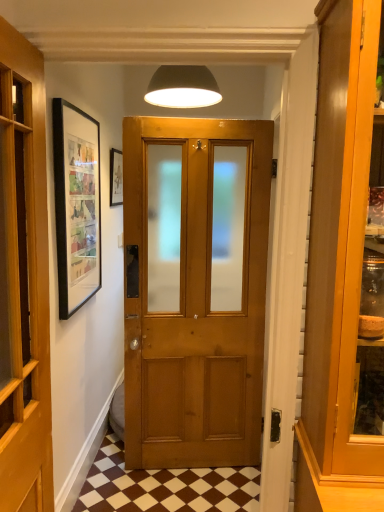
Find the location of a particular element. Image resolution: width=384 pixels, height=512 pixels. wooden door at center is located at coordinates (24, 281).

What do you see at coordinates (183, 87) in the screenshot? I see `matte black lampshade at upper center` at bounding box center [183, 87].

Locate an element on the screen. The image size is (384, 512). brown checkered tile at lower center is located at coordinates (164, 486).

Locate an element on the screen. This screenshot has width=384, height=512. wooden door at center is located at coordinates pos(24,281).

Locate an element on the screen. This screenshot has height=512, width=384. picture frame behind the matte black lampshade at upper center is located at coordinates (116, 177).

Measure the distance between matte black picture frame at upper left and matte black lampshade at upper center.

25.88 inches.

Is point (120, 183) closer or farther from the camera than point (147, 92)?

Point (120, 183) appears to be closer to the viewer than point (147, 92).

Between matte black lampshade at upper center and wooden door at center, which one has larger size?

With larger size is wooden door at center.

Considering the points (166, 75) and (40, 85), which point is in front, point (166, 75) or point (40, 85)?

Positioned in front is point (40, 85).

Is matte black lampshade at upper center shorter than wooden door at center?

Correct, matte black lampshade at upper center is not as tall as wooden door at center.

Which is more to the left, matte black lampshade at upper center or wooden door at center?

From the viewer's perspective, wooden door at center appears more on the left side.

From the picture: What's the angular difference between brown checkered tile at lower center and wooden door at center's facing directions?

The angular difference between brown checkered tile at lower center and wooden door at center is 92.6 degrees.

Where is `tile that is under the wooden door at center (from a real-world perspective)`? tile that is under the wooden door at center (from a real-world perspective) is located at coordinates (164, 486).

In terms of height, does brown checkered tile at lower center look taller or shorter compared to wooden door at center?

Clearly, brown checkered tile at lower center is shorter compared to wooden door at center.

From the image's perspective, is brown checkered tile at lower center on wooden door at center?

No, from the image's perspective, brown checkered tile at lower center is not on top of wooden door at center.

From a real-world perspective, is matte black lampshade at upper center positioned over matte black picture frame at upper left based on gravity?

Correct, in the physical world, matte black lampshade at upper center is higher than matte black picture frame at upper left.

Is matte black lampshade at upper center touching matte black picture frame at upper left?

No, matte black lampshade at upper center is not beside matte black picture frame at upper left.

Considering the relative sizes of matte black lampshade at upper center and matte black picture frame at upper left in the image provided, is matte black lampshade at upper center taller than matte black picture frame at upper left?

Incorrect, the height of matte black lampshade at upper center is not larger of that of matte black picture frame at upper left.

Looking at this image, is matte black lampshade at upper center behind brown checkered tile at lower center?

Yes, matte black lampshade at upper center is further from the camera.

Would you say matte black lampshade at upper center contains brown checkered tile at lower center?

No, brown checkered tile at lower center is not surrounded by matte black lampshade at upper center.

Is matte black lampshade at upper center at the right side of brown checkered tile at lower center?

Yes, matte black lampshade at upper center is to the right of brown checkered tile at lower center.

Which is less distant, [171,66] or [250,510]?

Point [171,66] is positioned farther from the camera compared to point [250,510].

Does point (12, 308) come closer to viewer compared to point (198, 82)?

Yes, point (12, 308) is in front of point (198, 82).

Which object is positioned more to the left, wooden door at center or matte black lampshade at upper center?

Positioned to the left is wooden door at center.

Does wooden door at center have a lesser width compared to matte black lampshade at upper center?

Correct, the width of wooden door at center is less than that of matte black lampshade at upper center.

In the scene shown: From the image's perspective, who appears lower, brown checkered tile at lower center or matte black picture frame at upper left?

brown checkered tile at lower center, from the image's perspective.

Considering the sizes of objects brown checkered tile at lower center and matte black picture frame at upper left in the image provided, who is wider, brown checkered tile at lower center or matte black picture frame at upper left?

With larger width is brown checkered tile at lower center.

Considering the relative sizes of brown checkered tile at lower center and matte black picture frame at upper left in the image provided, is brown checkered tile at lower center shorter than matte black picture frame at upper left?

Yes.

Does brown checkered tile at lower center appear on the right side of matte black picture frame at upper left?

Correct, you'll find brown checkered tile at lower center to the right of matte black picture frame at upper left.

Locate an element on the screen. This screenshot has height=512, width=384. picture frame on the left of the matte black lampshade at upper center is located at coordinates (116, 177).

At what (x,y) coordinates should I click in order to perform the action: click on lamp above the wooden door at center (from the image's perspective). Please return your answer as a coordinate pair (x, y). Looking at the image, I should click on (183, 87).

Looking at the image, which one is located closer to brown checkered tile at lower center, wooden door at center or matte black lampshade at upper center?

wooden door at center is positioned closer to the anchor brown checkered tile at lower center.

Looking at the image, which one is located closer to wooden door at center, brown checkered tile at lower center or matte black lampshade at upper center?

The object closer to wooden door at center is matte black lampshade at upper center.

When comparing their distances from matte black picture frame at upper left, does brown checkered tile at lower center or matte black lampshade at upper center seem further?

brown checkered tile at lower center.

From the image, which object appears to be nearer to brown checkered tile at lower center, matte black picture frame at upper left or matte black lampshade at upper center?

matte black picture frame at upper left.

Looking at this image, when comparing their distances from wooden door at center, does matte black picture frame at upper left or brown checkered tile at lower center seem closer?

Among the two, brown checkered tile at lower center is located nearer to wooden door at center.

Considering their positions, is brown checkered tile at lower center positioned closer to matte black lampshade at upper center than matte black picture frame at upper left?

matte black picture frame at upper left lies closer to matte black lampshade at upper center than the other object.

From the image, which object appears to be farther from matte black lampshade at upper center, brown checkered tile at lower center or wooden door at center?

brown checkered tile at lower center is further to matte black lampshade at upper center.

From the image, which object appears to be farther from brown checkered tile at lower center, matte black lampshade at upper center or wooden door at center?

matte black lampshade at upper center is further to brown checkered tile at lower center.

Identify the location of picture frame between matte black lampshade at upper center and brown checkered tile at lower center vertically. (116, 177).

Image resolution: width=384 pixels, height=512 pixels. Find the location of `lamp between wooden door at center and matte black picture frame at upper left along the z-axis`. lamp between wooden door at center and matte black picture frame at upper left along the z-axis is located at coordinates tap(183, 87).

Where is `door between matte black lampshade at upper center and brown checkered tile at lower center vertically`? The image size is (384, 512). door between matte black lampshade at upper center and brown checkered tile at lower center vertically is located at coordinates (24, 281).

Locate an element on the screen. The width and height of the screenshot is (384, 512). tile between wooden door at center and matte black picture frame at upper left from front to back is located at coordinates (164, 486).